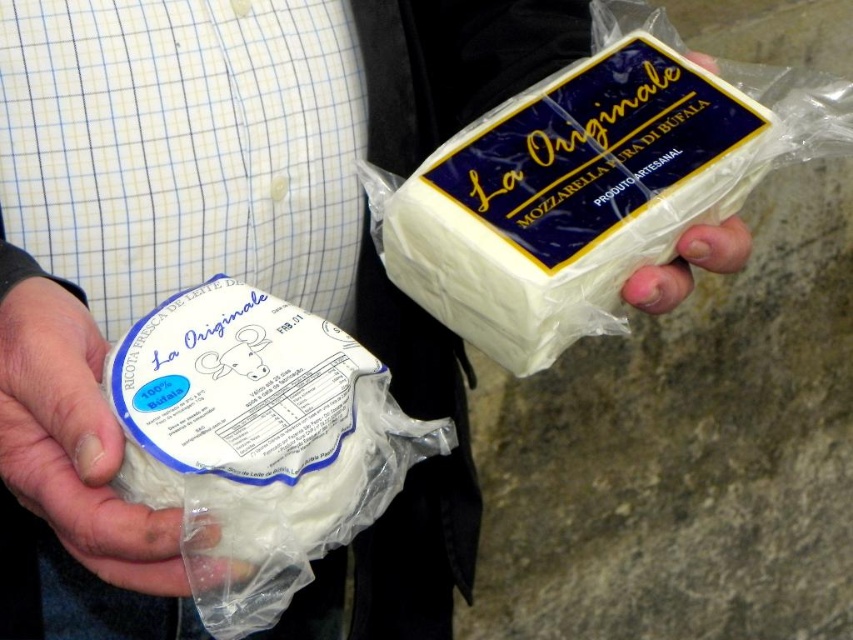
You are a food inspector examining the packages. You need to check the expiration date on the pale skin at center. Can you see it without moving the white matte cheese at left?

The white matte cheese at left is in front of the pale skin at center, so you cannot see the expiration date on the pale skin at center without moving the white matte cheese at left.

Based on the photo, you are a food inspector examining two cheeses on a table. You see the white creamy cheese at left and the white matte cheese at left. Which cheese is nearer to you?

The white creamy cheese at left is closer to the viewer than the white matte cheese at left.